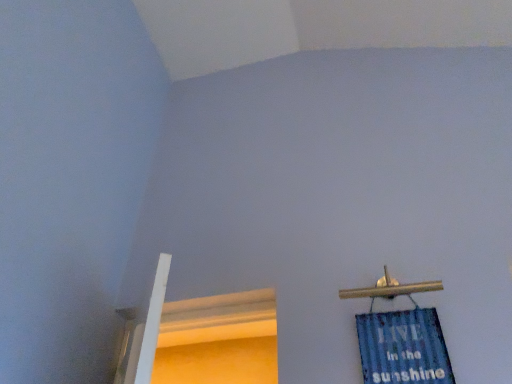
The height and width of the screenshot is (384, 512). What do you see at coordinates (403, 348) in the screenshot? I see `blue corrugated metal banner at upper right` at bounding box center [403, 348].

Where is `blue corrugated metal banner at upper right`? Image resolution: width=512 pixels, height=384 pixels. blue corrugated metal banner at upper right is located at coordinates (403, 348).

Consider the image. Measure the distance between blue corrugated metal banner at upper right and camera.

The depth of blue corrugated metal banner at upper right is 4.73 feet.

Locate an element on the screen. The width and height of the screenshot is (512, 384). blue corrugated metal banner at upper right is located at coordinates (403, 348).